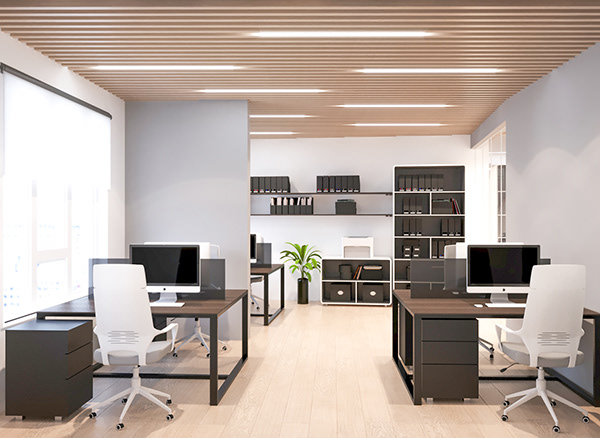
The width and height of the screenshot is (600, 438). What are the coordinates of `wall` in the screenshot? It's located at (111, 103), (176, 132), (307, 150), (571, 163), (484, 147).